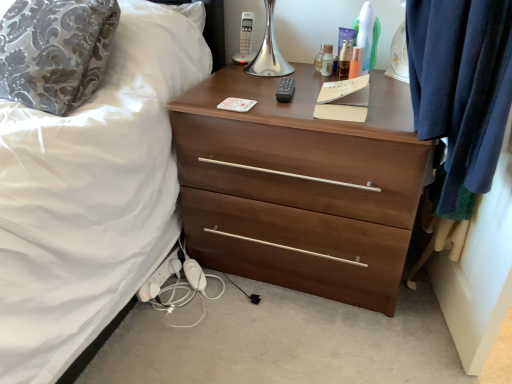
Locate an element on the screen. The height and width of the screenshot is (384, 512). vacant space behind black plastic remote at center is located at coordinates (279, 80).